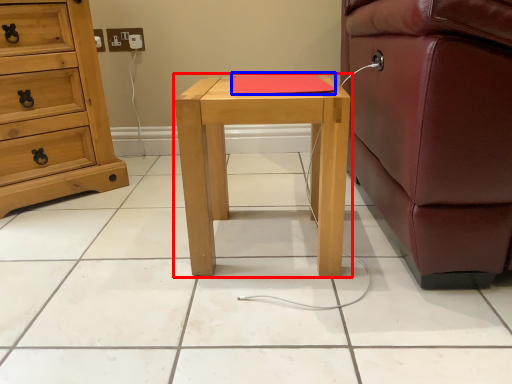
Question: Which of the following is the farthest to the observer, nightstand (highlighted by a red box) or pad (highlighted by a blue box)?

Choices:
 (A) nightstand
 (B) pad

Answer: (B)